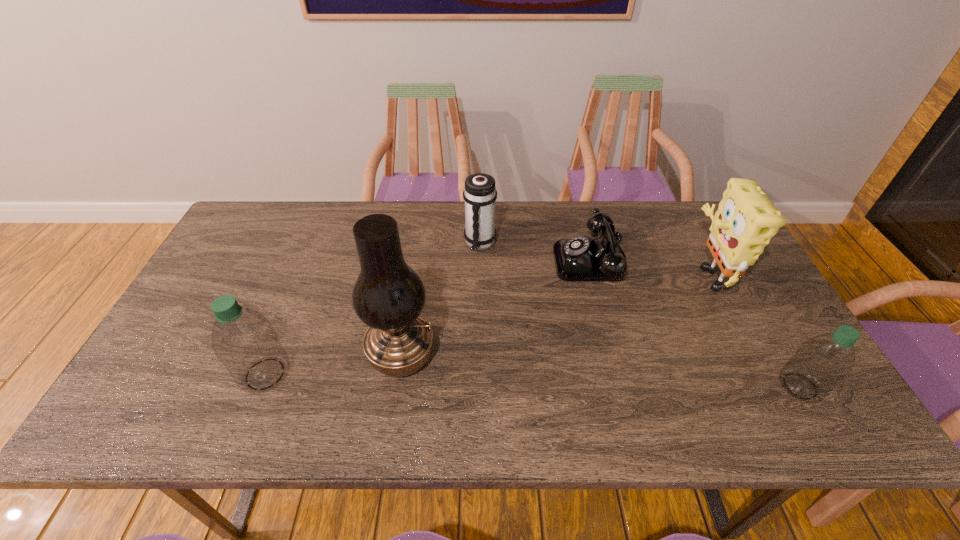
Find the location of a particular element. This screenshot has height=540, width=960. vacant space located on the back of the right water bottle is located at coordinates (761, 319).

At what (x,y) coordinates should I click in order to perform the action: click on free space located 0.340m on the face of the sponge. Please return your answer as a coordinate pair (x, y). The height and width of the screenshot is (540, 960). Looking at the image, I should click on (568, 273).

Where is `free point located 0.240m on the face of the sponge`? free point located 0.240m on the face of the sponge is located at coordinates (603, 273).

Where is `vacant space positioned on the face of the sponge`? vacant space positioned on the face of the sponge is located at coordinates (551, 273).

Identify the location of vacant point located on the side with the handle of the fourth object from right to left. (480, 323).

Where is `vacant space situated on the dial of the telephone`? vacant space situated on the dial of the telephone is located at coordinates (420, 260).

Where is `vacant point located 0.320m on the dial of the telephone`? vacant point located 0.320m on the dial of the telephone is located at coordinates (447, 260).

Locate an element on the screen. Image resolution: width=960 pixels, height=540 pixels. blank area located on the dial of the telephone is located at coordinates (450, 260).

At what (x,y) coordinates should I click in order to perform the action: click on free region located on the left of the fifth object from right to left. Please return your answer as a coordinate pair (x, y). The height and width of the screenshot is (540, 960). Looking at the image, I should click on (266, 356).

I want to click on sponge situated at the far edge, so pos(746,220).